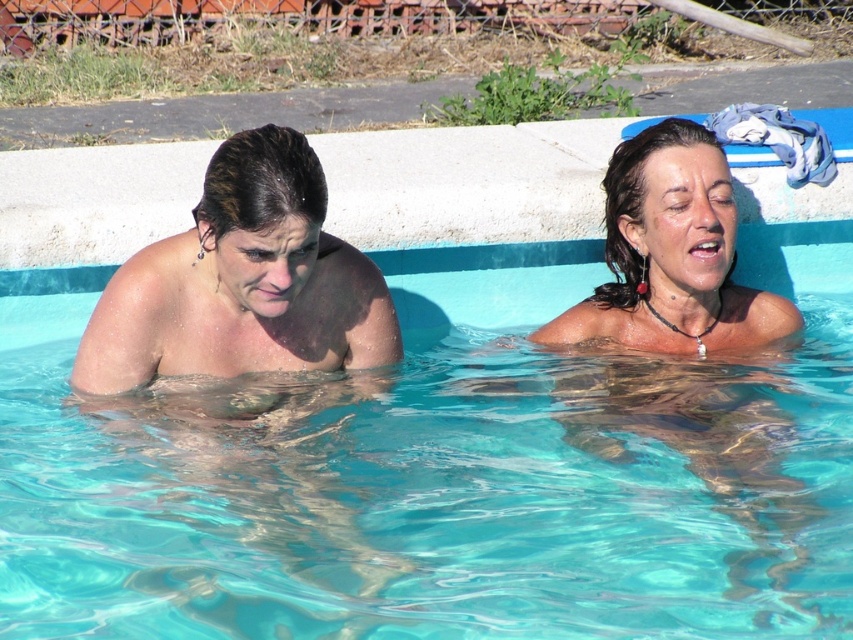
Question: Does smooth skin woman at left have a larger size compared to wet hair at upper right?

Choices:
 (A) no
 (B) yes

Answer: (A)

Question: Which is nearer to the wet hair at upper right?

Choices:
 (A) smooth skin woman at left
 (B) clear blue water at center

Answer: (B)

Question: Which point is farther to the camera?

Choices:
 (A) wet hair at upper right
 (B) clear blue water at center
 (C) smooth skin woman at left

Answer: (A)

Question: Which of the following is the closest to the observer?

Choices:
 (A) wet hair at upper right
 (B) clear blue water at center
 (C) smooth skin woman at left

Answer: (B)

Question: Is clear blue water at center to the left of smooth skin woman at left from the viewer's perspective?

Choices:
 (A) yes
 (B) no

Answer: (B)

Question: Is smooth skin woman at left thinner than wet hair at upper right?

Choices:
 (A) no
 (B) yes

Answer: (B)